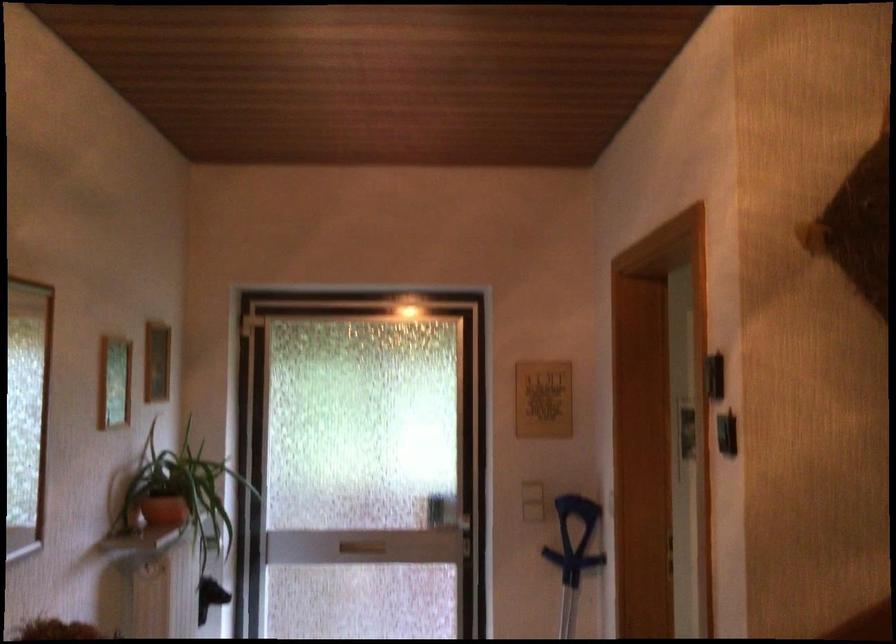
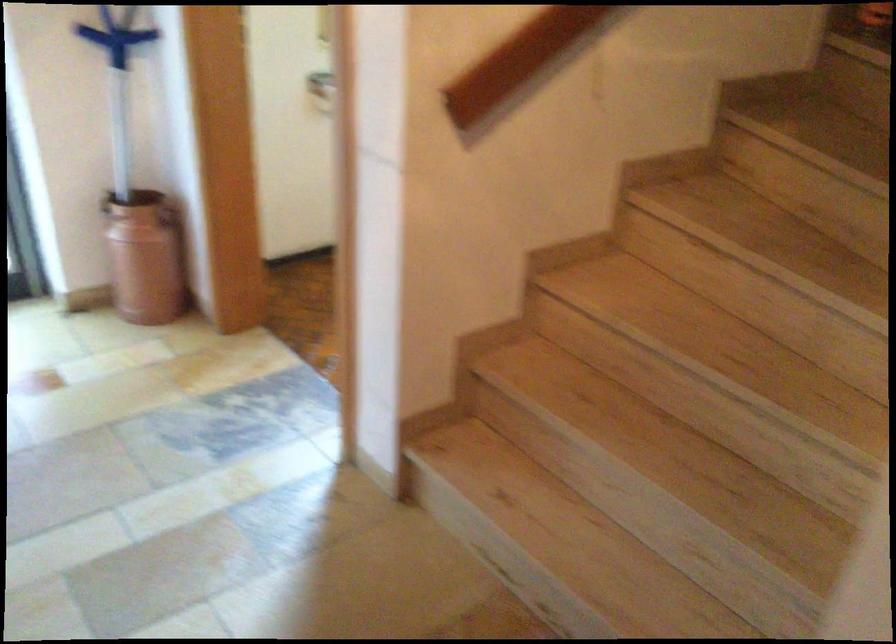
Based on the continuous images, in which direction is the camera rotating?

The camera rotated toward right-down.